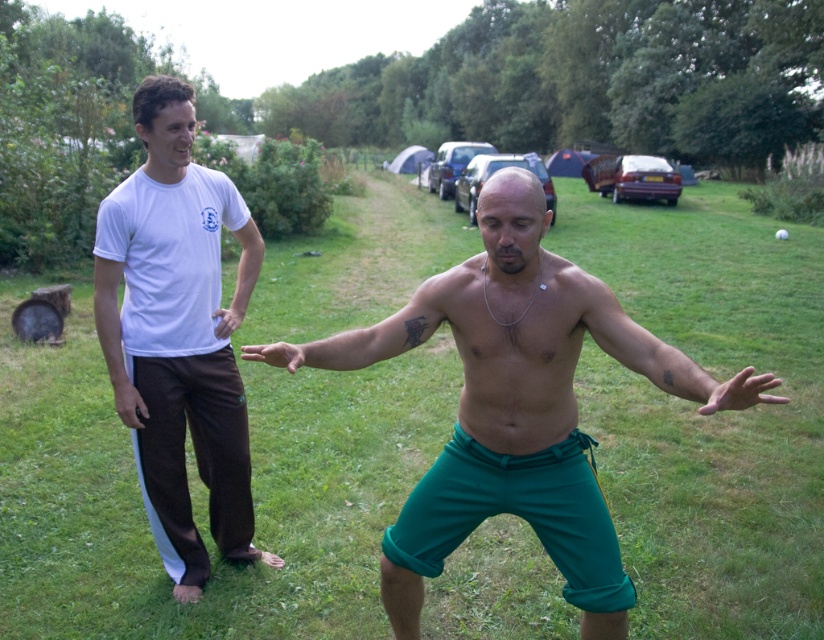
Which of these two, green fabric hand at center or black matte phone at left, stands taller?

With more height is black matte phone at left.

From the picture: Does green fabric hand at center appear over black matte phone at left?

No, green fabric hand at center is not above black matte phone at left.

At what (x,y) coordinates should I click in order to perform the action: click on green fabric hand at center. Please return your answer as a coordinate pair (x, y). The width and height of the screenshot is (824, 640). Looking at the image, I should click on (742, 392).

In the scene shown: Between white cotton t-shirt at left and matte white shirt at left, which one appears on the left side from the viewer's perspective?

Positioned to the left is white cotton t-shirt at left.

Is white cotton t-shirt at left positioned behind matte white shirt at left?

No, white cotton t-shirt at left is closer to the viewer.

This screenshot has width=824, height=640. What are the coordinates of `white cotton t-shirt at left` in the screenshot? It's located at (179, 333).

Which is in front, point (258, 310) or point (757, 376)?

Positioned in front is point (757, 376).

Which is behind, point (790, 566) or point (719, 390)?

The point (790, 566) is behind.

Locate an element on the screen. green grass at center is located at coordinates (206, 492).